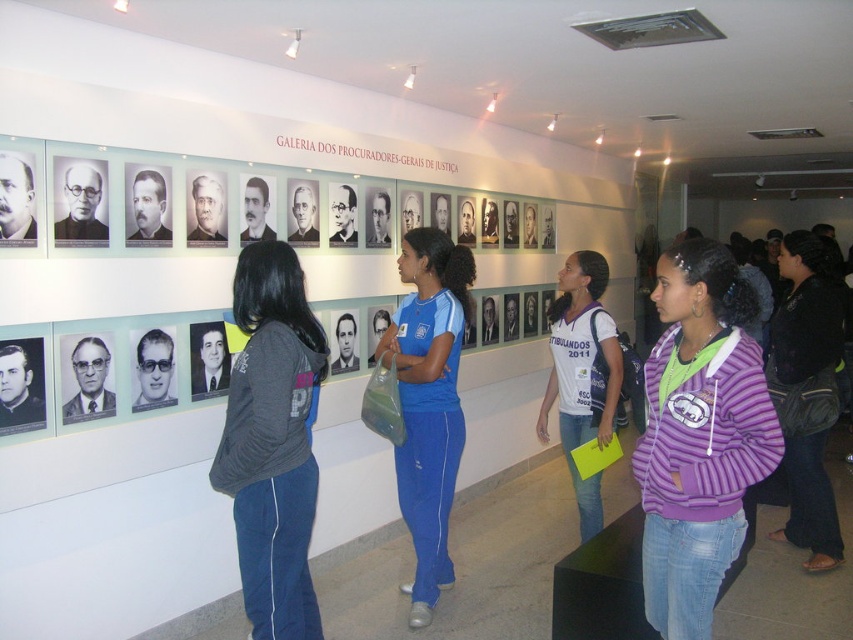
You are standing in the gallery and notice two purple garments. The first is a purple striped hoodie at lower right and the second is a purple fleece jacket at center. Which garment is positioned higher on the wall?

The purple striped hoodie at lower right is positioned higher on the wall than the purple fleece jacket at center because it is above it.

Looking at this image, you are standing in the gallery and want to know which clothing item is shorter between the purple striped hoodie at lower right and the purple fleece jacket at center. Can you determine this based on their positions?

The purple striped hoodie at lower right is shorter than the purple fleece jacket at center.